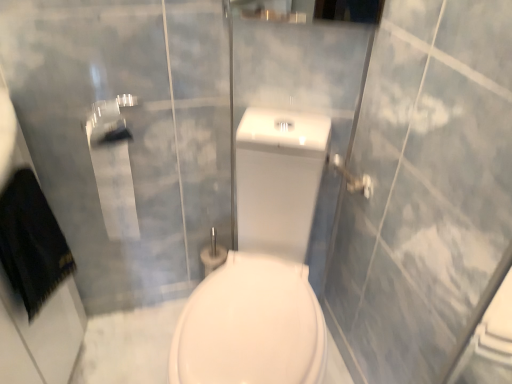
Question: Are metallic silver towel bar at upper right and white glossy porcelain at center making contact?

Choices:
 (A) yes
 (B) no

Answer: (B)

Question: Is metallic silver towel bar at upper right positioned before white glossy porcelain at center?

Choices:
 (A) no
 (B) yes

Answer: (A)

Question: Considering the relative sizes of metallic silver towel bar at upper right and white glossy porcelain at center in the image provided, is metallic silver towel bar at upper right bigger than white glossy porcelain at center?

Choices:
 (A) no
 (B) yes

Answer: (A)

Question: Is metallic silver towel bar at upper right taller than white glossy porcelain at center?

Choices:
 (A) yes
 (B) no

Answer: (B)

Question: Is metallic silver towel bar at upper right completely or partially outside of white glossy porcelain at center?

Choices:
 (A) no
 (B) yes

Answer: (A)

Question: Considering the relative positions of metallic silver towel bar at upper right and white glossy porcelain at center in the image provided, is metallic silver towel bar at upper right to the right of white glossy porcelain at center from the viewer's perspective?

Choices:
 (A) no
 (B) yes

Answer: (B)

Question: From the image's perspective, does white glossy porcelain at center appear higher than metallic silver towel bar at upper right?

Choices:
 (A) yes
 (B) no

Answer: (B)

Question: Does white glossy porcelain at center come in front of metallic silver towel bar at upper right?

Choices:
 (A) no
 (B) yes

Answer: (B)

Question: Can you confirm if white glossy porcelain at center is bigger than metallic silver towel bar at upper right?

Choices:
 (A) no
 (B) yes

Answer: (B)

Question: Is white glossy porcelain at center taller than metallic silver towel bar at upper right?

Choices:
 (A) no
 (B) yes

Answer: (B)

Question: Is metallic silver towel bar at upper right surrounded by white glossy porcelain at center?

Choices:
 (A) no
 (B) yes

Answer: (B)

Question: Is white glossy porcelain at center to the left of metallic silver towel bar at upper right from the viewer's perspective?

Choices:
 (A) yes
 (B) no

Answer: (A)

Question: From the image's perspective, is metallic silver towel bar at upper right located above or below white glossy porcelain at center?

Choices:
 (A) below
 (B) above

Answer: (B)